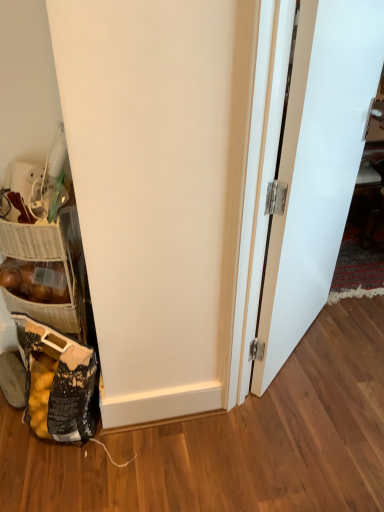
Locate an element on the screen. This screenshot has height=512, width=384. free space below white matte door at right (from a real-world perspective) is located at coordinates pyautogui.click(x=300, y=345).